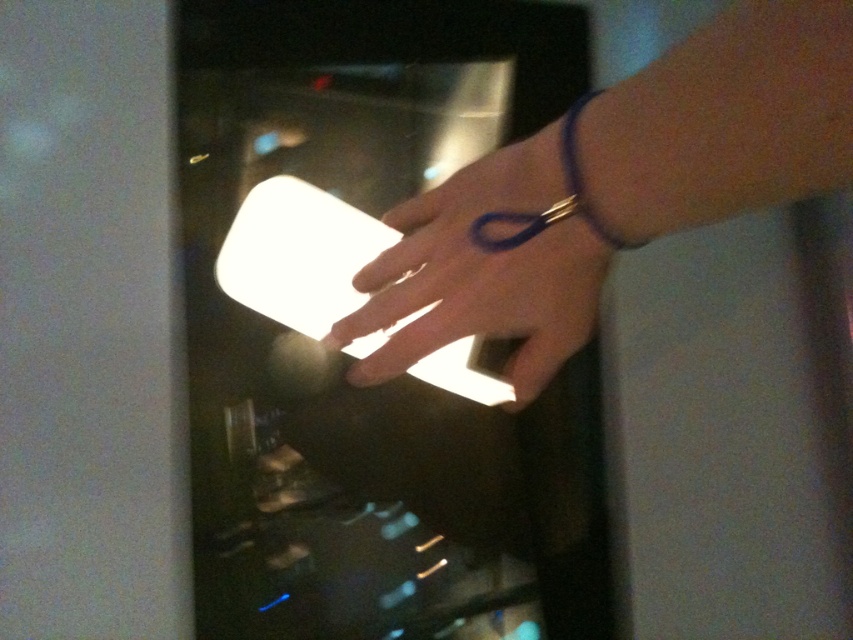
You are a photographer setting up a lighting setup for a product shoot. You need to position a small light source to cast a reflection on the white matte ring at center without illuminating the smooth skin hand at center. Based on the scene description, where should you place the light source relative to the hand?

The smooth skin hand at center is located above the white matte ring at center. To cast a reflection on the white matte ring at center without illuminating the hand, position the light source below the hand so that the reflection from the ring is directed downward away from the hand.

You are organizing a small party and need to place decorations. You have a white matte ring at center and a purple rubber band at upper right. According to the image, which decoration is positioned lower in the scene?

The white matte ring at center is positioned below the purple rubber band at upper right, so it is lower in the scene.